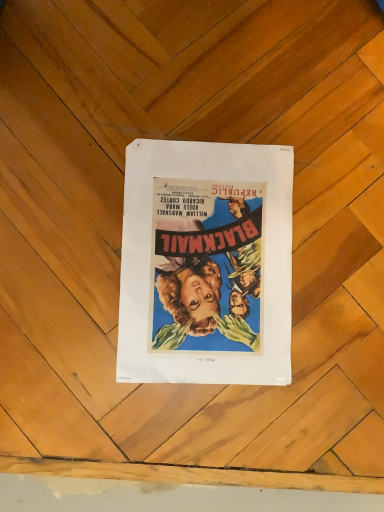
Find the location of a particular element. This screenshot has width=384, height=512. free spot above vibrant paper poster at center (from a real-world perspective) is located at coordinates (221, 257).